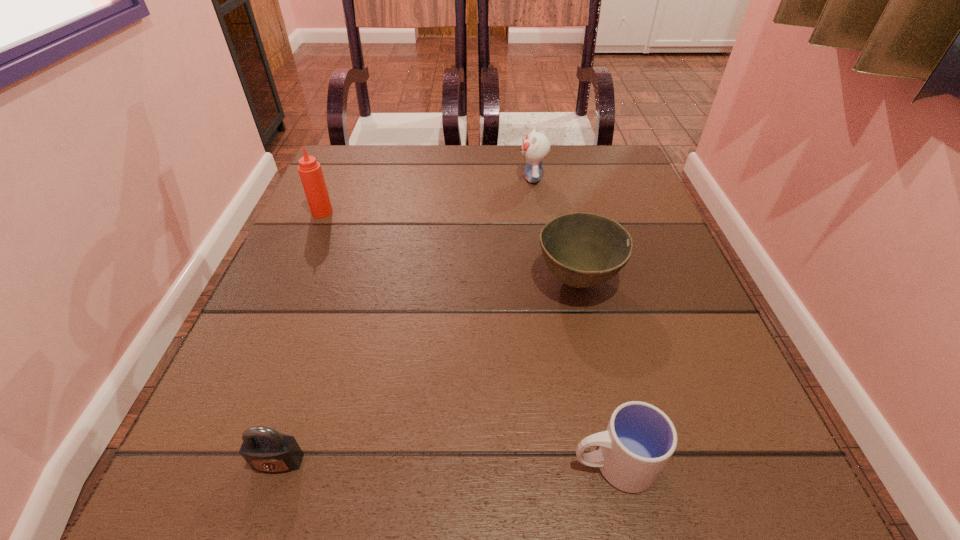
In the image, there is a desktop. Find the location of `free space at the near left corner`. free space at the near left corner is located at coordinates (306, 475).

You are a GUI agent. You are given a task and a screenshot of the screen. Output one action in this format:
    pyautogui.click(x=<x>, y=<y>)
    Task: Click on the vacant space at the far right corner of the desktop
    The width and height of the screenshot is (960, 540).
    Given the screenshot: What is the action you would take?
    pyautogui.click(x=618, y=156)

Find the location of a particular element. blank area at the near right corner is located at coordinates point(728,480).

Find the location of a particular element. This screenshot has height=540, width=960. vacant region between the Tabasco sauce and the cup is located at coordinates [x=468, y=338].

Where is `vacant area that lies between the cup and the fourth nearest object`? The height and width of the screenshot is (540, 960). vacant area that lies between the cup and the fourth nearest object is located at coordinates (468, 338).

At what (x,y) coordinates should I click in order to perform the action: click on free space that is in between the second farthest object and the farthest object. Please return your answer as a coordinate pair (x, y). Looking at the image, I should click on (427, 195).

Locate an element on the screen. This screenshot has height=540, width=960. empty space that is in between the kitten and the leftmost object is located at coordinates (427, 195).

Identify the location of free spot between the third farthest object and the cup. This screenshot has width=960, height=540. (595, 373).

Identify the location of vacant area between the fourth shortest object and the cup. Image resolution: width=960 pixels, height=540 pixels. (573, 321).

Where is `free space between the third nearest object and the leftmost object`? The height and width of the screenshot is (540, 960). free space between the third nearest object and the leftmost object is located at coordinates (449, 247).